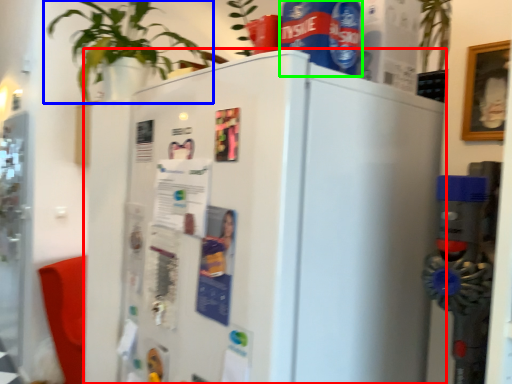
Question: Which object is positioned closest to refrigerator (highlighted by a red box)? Select from houseplant (highlighted by a blue box) and beverage (highlighted by a green box).

Choices:
 (A) houseplant
 (B) beverage

Answer: (B)